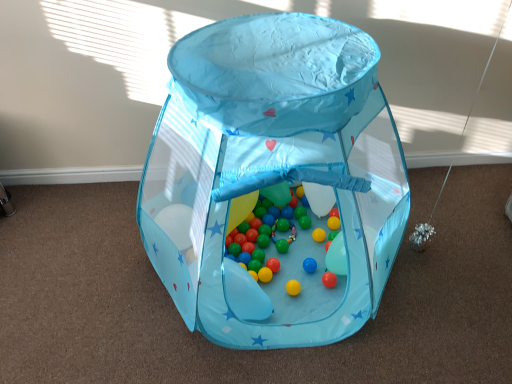
You are a GUI agent. You are given a task and a screenshot of the screen. Output one action in this format:
    pyautogui.click(x=<x>, y=<y>)
    Task: Click on the free spot above multicolored glossy balls at center, which ranks as the first toy in bottom-to-top order (from a real-world perspective)
    
    Given the screenshot: What is the action you would take?
    pyautogui.click(x=274, y=224)